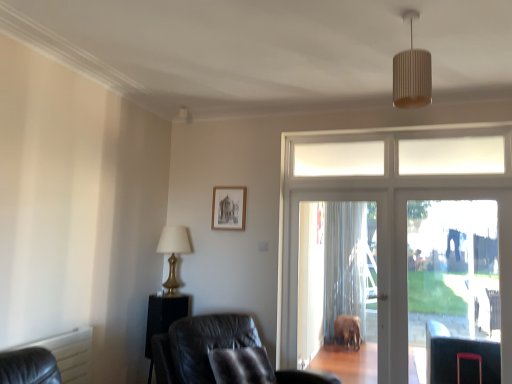
Question: Does white glass door at center have a smaller size compared to black leather side table at lower left?

Choices:
 (A) yes
 (B) no

Answer: (B)

Question: Is white glass door at center placed right next to black leather side table at lower left?

Choices:
 (A) yes
 (B) no

Answer: (B)

Question: Is the position of white glass door at center less distant than that of black leather side table at lower left?

Choices:
 (A) yes
 (B) no

Answer: (A)

Question: From a real-world perspective, is white glass door at center located beneath black leather side table at lower left?

Choices:
 (A) yes
 (B) no

Answer: (B)

Question: Is white glass door at center positioned behind black leather side table at lower left?

Choices:
 (A) yes
 (B) no

Answer: (B)

Question: Is black leather side table at lower left taller or shorter than transparent glass screen door at right, the 1th screen door from the right?

Choices:
 (A) tall
 (B) short

Answer: (B)

Question: Is point (173, 311) positioned closer to the camera than point (483, 337)?

Choices:
 (A) closer
 (B) farther

Answer: (A)

Question: Based on their positions, is black leather side table at lower left located to the left or right of transparent glass screen door at right, which is the second screen door in left-to-right order?

Choices:
 (A) left
 (B) right

Answer: (A)

Question: Is black leather side table at lower left bigger or smaller than transparent glass screen door at right, the 1th screen door from the right?

Choices:
 (A) small
 (B) big

Answer: (A)

Question: Based on their sizes in the image, would you say black leather side table at lower left is bigger or smaller than gold metallic table lamp at left?

Choices:
 (A) big
 (B) small

Answer: (A)

Question: In the image, is black leather side table at lower left positioned in front of or behind gold metallic table lamp at left?

Choices:
 (A) front
 (B) behind

Answer: (A)

Question: In the image, is black leather side table at lower left on the left side or the right side of gold metallic table lamp at left?

Choices:
 (A) left
 (B) right

Answer: (A)

Question: From a real-world perspective, is black leather side table at lower left positioned above or below gold metallic table lamp at left?

Choices:
 (A) below
 (B) above

Answer: (A)

Question: In the image, is white ribbed shade at upper center positioned in front of or behind black leather side table at lower left?

Choices:
 (A) behind
 (B) front

Answer: (B)

Question: Based on their sizes in the image, would you say white ribbed shade at upper center is bigger or smaller than black leather side table at lower left?

Choices:
 (A) big
 (B) small

Answer: (B)